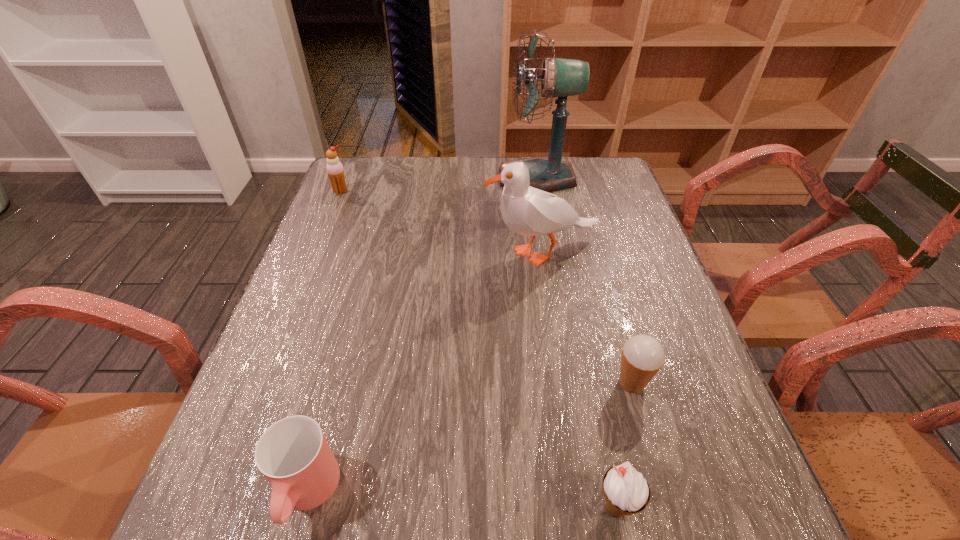
The height and width of the screenshot is (540, 960). Identify the location of icecream that is the second nearest to the fan. (643, 356).

I want to click on free location that satisfies the following two spatial constraints: 1. in front of the second icecream from right to left where the wind blows; 2. on the right side of the tallest object, so coord(594,507).

Find the location of a particular element. vacant space that satisfies the following two spatial constraints: 1. on the back side of the nearest icecream; 2. in front of the tallest object where the wind blows is located at coordinates (547, 178).

At what (x,y) coordinates should I click in order to perform the action: click on free location that satisfies the following two spatial constraints: 1. in front of the tallest object where the wind blows; 2. at the front with a straw on the leftmost object. Please return your answer as a coordinate pair (x, y). The image size is (960, 540). Looking at the image, I should click on (540, 191).

Where is `vacant region that satisfies the following two spatial constraints: 1. at the beak of the gull; 2. on the back side of the rightmost icecream`? This screenshot has height=540, width=960. vacant region that satisfies the following two spatial constraints: 1. at the beak of the gull; 2. on the back side of the rightmost icecream is located at coordinates click(563, 383).

At what (x,y) coordinates should I click in order to perform the action: click on free space that satisfies the following two spatial constraints: 1. at the beak of the nearest icecream; 2. on the left side of the fourth nearest object. Please return your answer as a coordinate pair (x, y). This screenshot has width=960, height=540. Looking at the image, I should click on (582, 507).